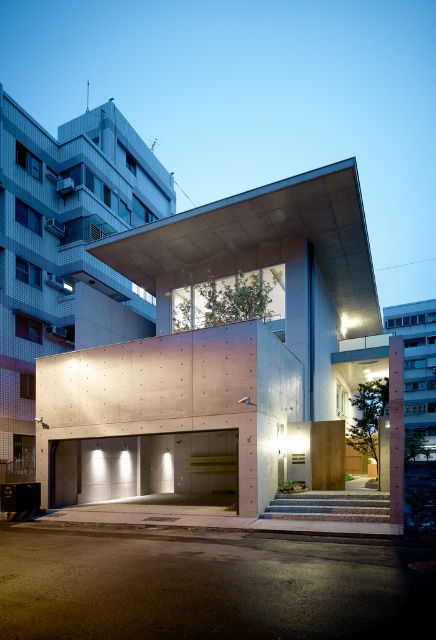
Question: Which point is farther to the camera?

Choices:
 (A) (95, 561)
 (B) (353, 328)

Answer: (B)

Question: Among these points, which one is nearest to the camera?

Choices:
 (A) (126, 236)
 (B) (78, 602)

Answer: (B)

Question: Among these objects, which one is nearest to the camera?

Choices:
 (A) smooth concrete at lower center
 (B) concrete parking garage at center

Answer: (A)

Question: Considering the relative positions of concrete parking garage at center and smooth concrete at lower center in the image provided, where is concrete parking garage at center located with respect to smooth concrete at lower center?

Choices:
 (A) left
 (B) right

Answer: (B)

Question: Is concrete parking garage at center wider than smooth concrete at lower center?

Choices:
 (A) no
 (B) yes

Answer: (B)

Question: Is concrete parking garage at center bigger than smooth concrete at lower center?

Choices:
 (A) yes
 (B) no

Answer: (A)